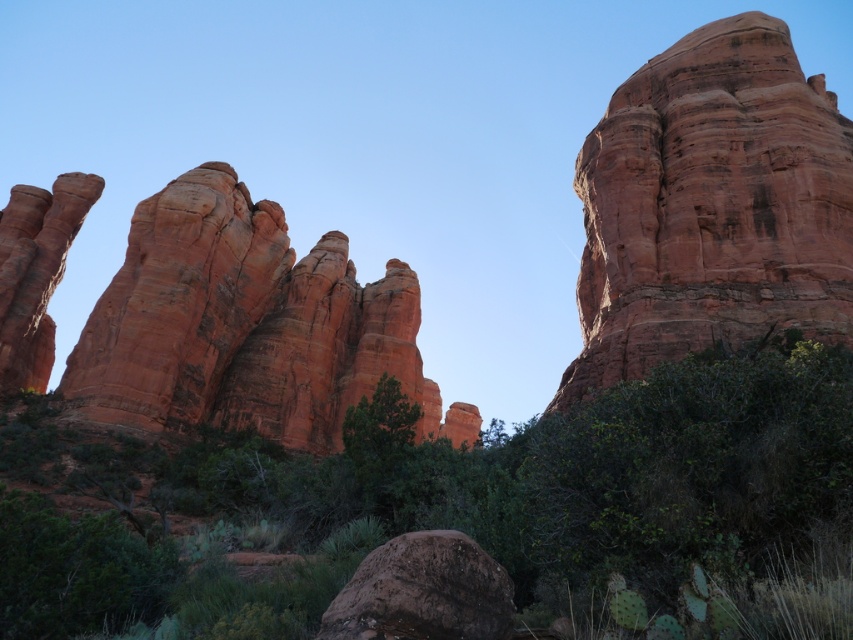
You are standing at the center of the scene looking upwards. Which direction should you turn to see the rustic sandstone rock formation at upper right?

The rustic sandstone rock formation at upper right is located at point [711,205], which is towards the upper right direction from your current position at the center. Turn your head upwards and to the right to face that direction.

You are standing in front of the red rock formations and want to take a photo. You notice two points marked as point (315,248) and point (404,618). Which point is closer to your camera?

Point (315,248) is closer to the camera than point (404,618) because it is further to the camera than point (404,618).

You are standing at the base of the red rock formations and see two points marked in the image. The first point is at coordinates point (691, 170) and the second is at point (402, 563). Which point is closer to you?

Point (402, 563) is closer to you because it is in front of point (691, 170).